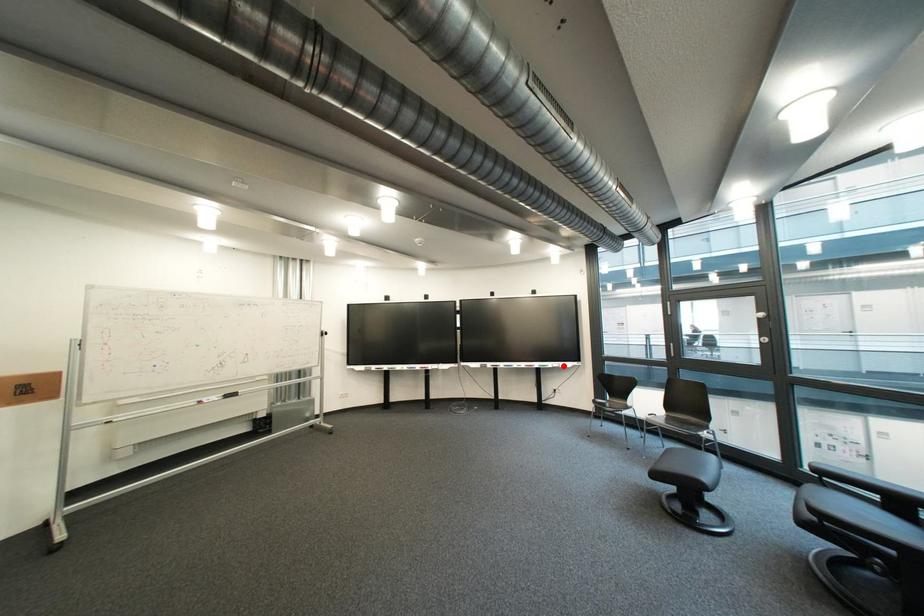
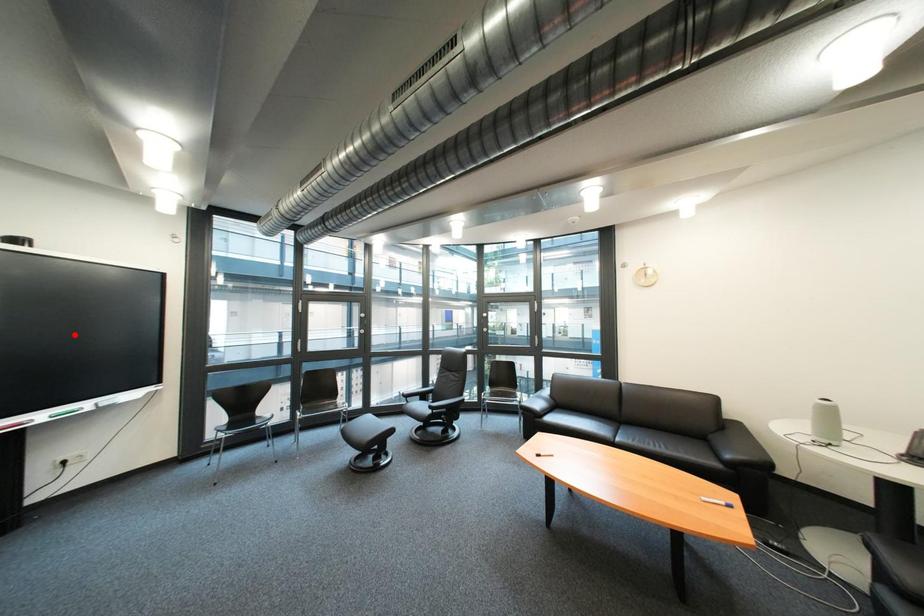
I am providing you with two images of the same scene from different viewpoints. A red point is marked on the first image and another point is marked on the second image. Is the red point in image1 aligned with the point shown in image2?

No